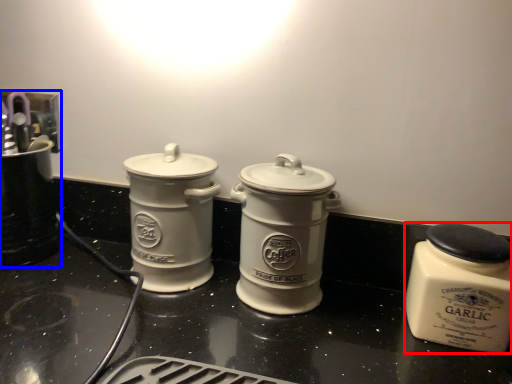
Question: Which point is further to the camera, kitchen appliance (highlighted by a red box) or appliance (highlighted by a blue box)?

Choices:
 (A) kitchen appliance
 (B) appliance

Answer: (B)